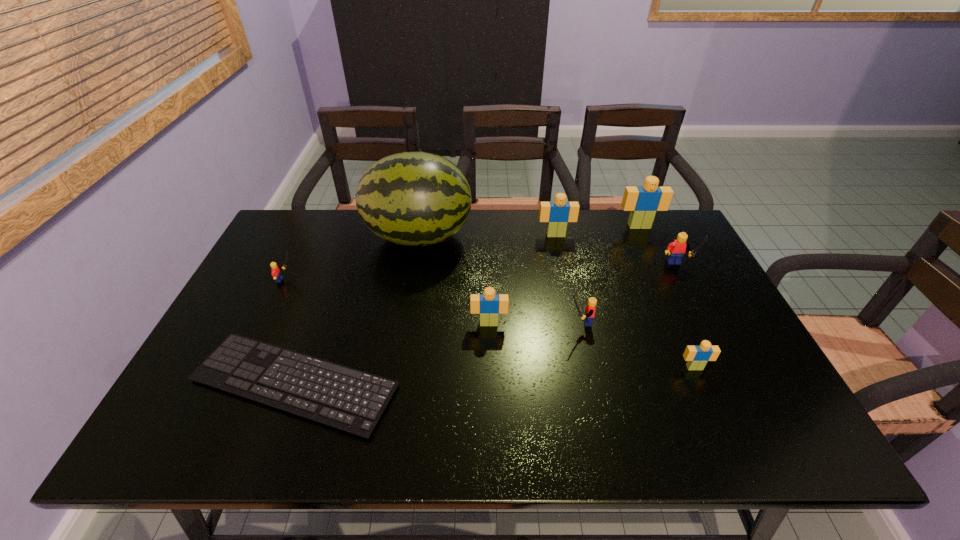
Identify which object is the fourth nearest to the second yellow Lego from left to right. Please provide its 2D coordinates. Your answer should be formatted as a tuple, i.e. [(x, y)], where the tuple contains the x and y coordinates of a point satisfying the conditions above.

[(410, 198)]

Find the location of a particular element. The image size is (960, 540). object that is the seventh closest to the sixth object from right to left is located at coordinates (276, 273).

You are a GUI agent. You are given a task and a screenshot of the screen. Output one action in this format:
    pyautogui.click(x=<x>, y=<y>)
    Task: Click on the Lego that can be found as the third closest to the sixth nearest Lego
    
    Given the screenshot: What is the action you would take?
    pyautogui.click(x=590, y=308)

Locate which Lego is the fifth closest to the black computer keyboard. Please provide its 2D coordinates. Your answer should be formatted as a tuple, i.e. [(x, y)], where the tuple contains the x and y coordinates of a point satisfying the conditions above.

[(697, 357)]

In order to click on beige Lego that stands as the closest to the nearest Lego in this screenshot , I will do click(489, 305).

Locate an element on the screen. The height and width of the screenshot is (540, 960). the second closest beige Lego to the watermelon is located at coordinates (489, 305).

Point out which yellow Lego is positioned as the second nearest to the second biggest yellow Lego. Please provide its 2D coordinates. Your answer should be formatted as a tuple, i.e. [(x, y)], where the tuple contains the x and y coordinates of a point satisfying the conditions above.

[(276, 273)]

In order to click on yellow Lego that is the nearest to the tallest object in this screenshot , I will do `click(276, 273)`.

The width and height of the screenshot is (960, 540). In order to click on free space that satisfies the following two spatial constraints: 1. on the front-facing side of the second smallest yellow Lego; 2. on the face of the leftmost beige Lego in this screenshot , I will do `click(579, 323)`.

The image size is (960, 540). What are the coordinates of `vacant position in the image that satisfies the following two spatial constraints: 1. on the face of the tallest Lego; 2. on the front-facing side of the second smallest yellow Lego` in the screenshot? It's located at (684, 322).